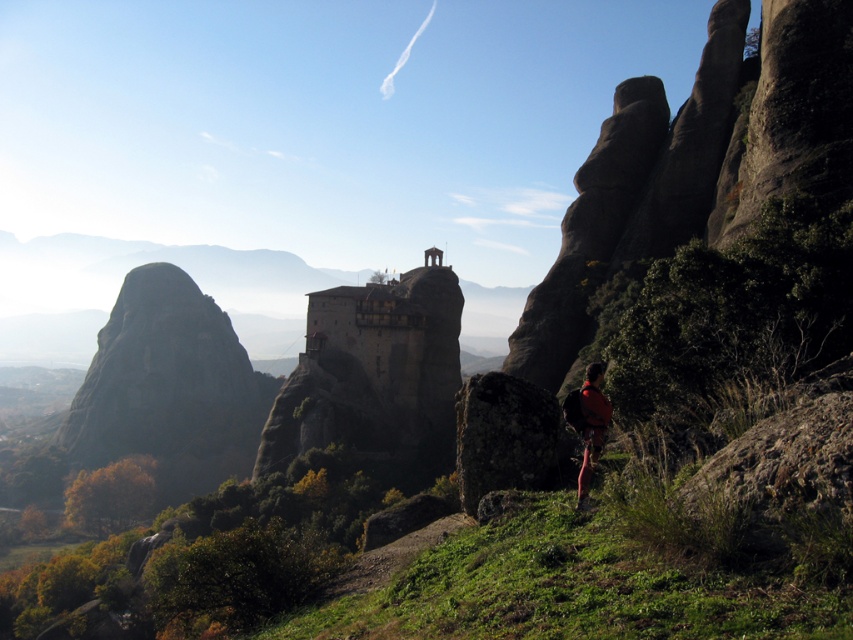
Who is lower down, stone building at center or rough textured rock at center?

stone building at center

Does stone building at center have a smaller size compared to rough textured rock at center?

Incorrect, stone building at center is not smaller in size than rough textured rock at center.

Which is in front, point (328, 300) or point (469, 403)?

Point (469, 403)

Locate an element on the screen. Image resolution: width=853 pixels, height=640 pixels. stone building at center is located at coordinates (375, 378).

Is stone building at center bigger than orange fabric backpack at lower right?

Yes.

Can you confirm if stone building at center is wider than orange fabric backpack at lower right?

Indeed, stone building at center has a greater width compared to orange fabric backpack at lower right.

Is point (346, 294) positioned before point (601, 368)?

No, (346, 294) is further to viewer.

Identify the location of stone building at center. click(375, 378).

Who is positioned more to the right, rough textured rock at center or orange fabric backpack at lower right?

orange fabric backpack at lower right is more to the right.

Is rough textured rock at center positioned behind orange fabric backpack at lower right?

Yes, rough textured rock at center is behind orange fabric backpack at lower right.

Locate an element on the screen. This screenshot has width=853, height=640. rough textured rock at center is located at coordinates tap(502, 435).